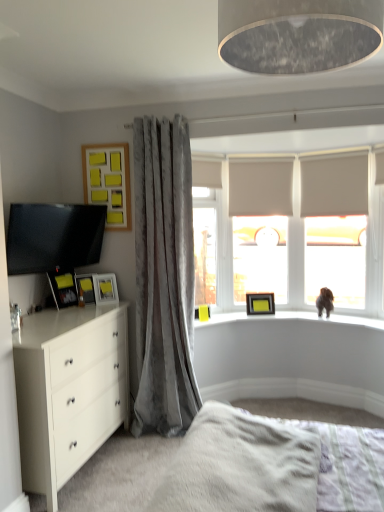
Locate an element on the screen. spots to the right of matte black picture frame at left, marked as the fourth picture frame in a bottom-to-top arrangement is located at coordinates coord(83,308).